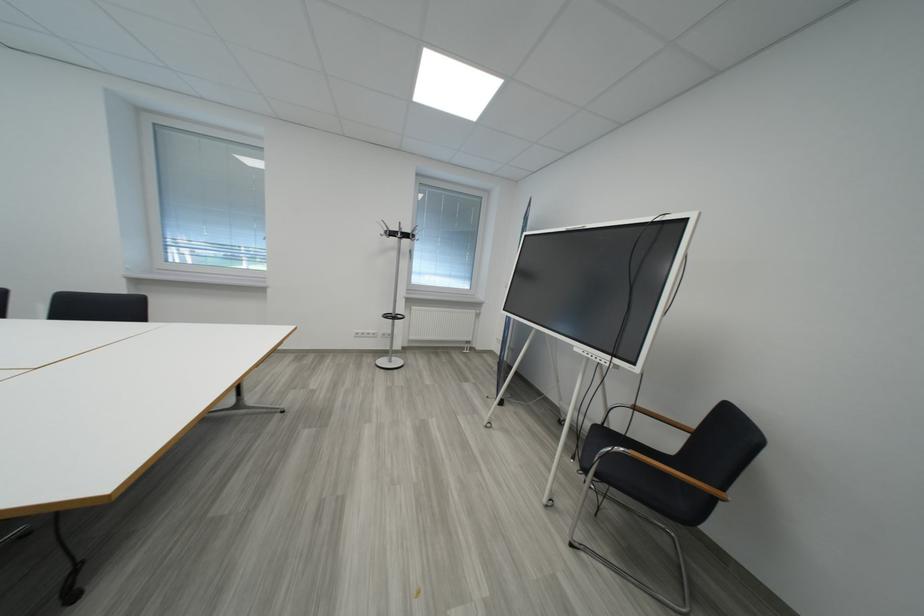
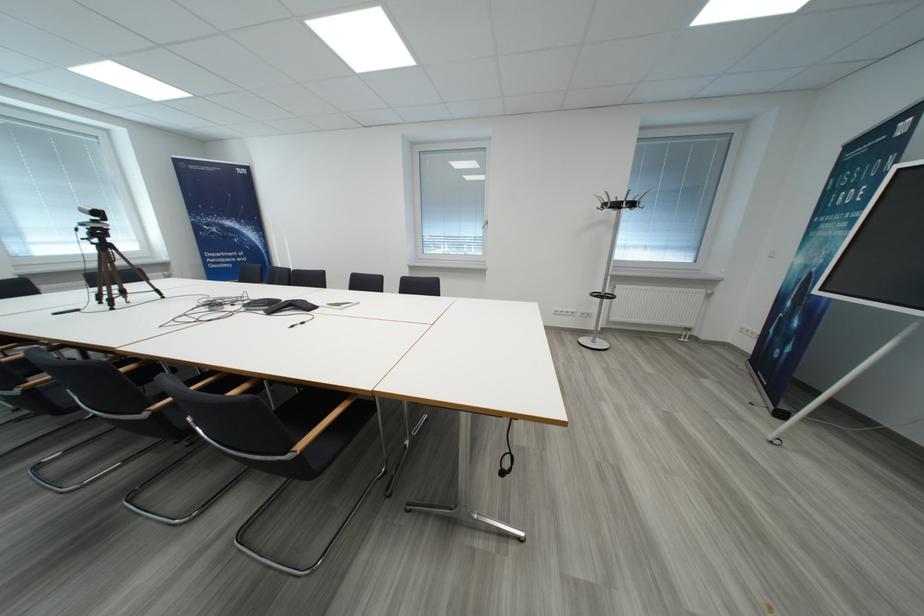
Question: The first image is from the beginning of the video and the second image is from the end. How did the camera likely rotate when shooting the video?

Choices:
 (A) Left
 (B) Right
 (C) Up
 (D) Down

Answer: (A)